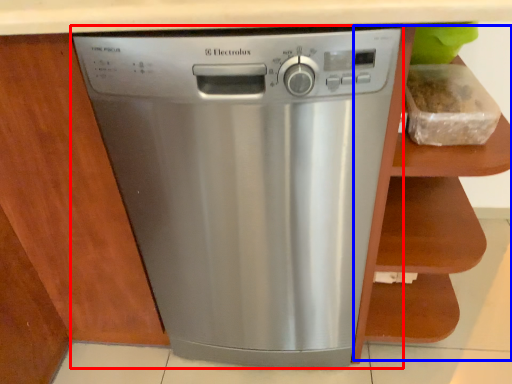
Question: Which of the following is the closest to the observer, home appliance (highlighted by a red box) or cabinet (highlighted by a blue box)?

Choices:
 (A) home appliance
 (B) cabinet

Answer: (B)